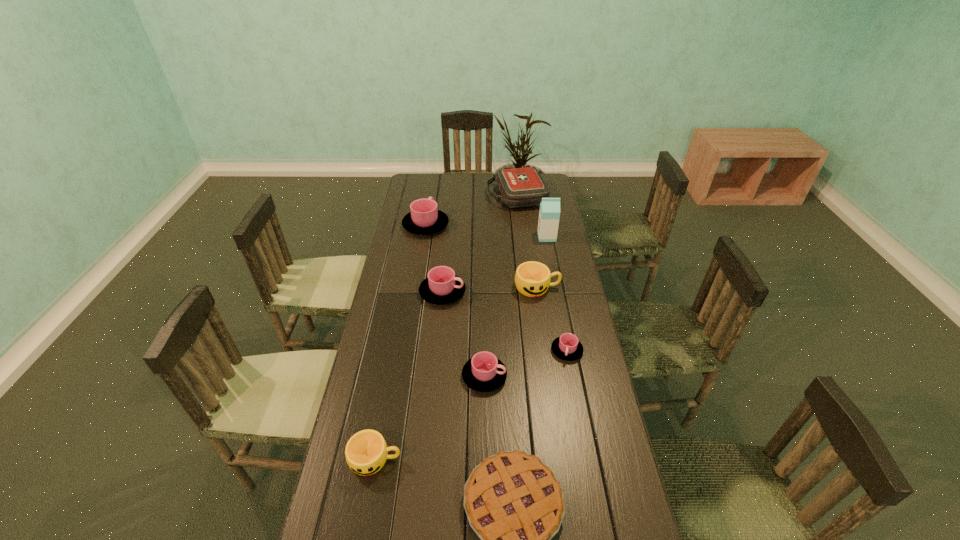
Locate an element on the screen. This screenshot has height=540, width=960. free space located 0.120m on the left of the farther beige cup is located at coordinates (484, 288).

The height and width of the screenshot is (540, 960). In order to click on vacant space located on the side with the handle of the second smallest pink cup in this screenshot , I will do `click(535, 376)`.

Where is `vacant space located on the right of the left beige cup`? vacant space located on the right of the left beige cup is located at coordinates (470, 460).

Find the location of `vacant point located 0.260m on the side with the handle of the shortest cup`. vacant point located 0.260m on the side with the handle of the shortest cup is located at coordinates (583, 436).

At what (x,y) coordinates should I click in order to perform the action: click on object that is at the far edge. Please return your answer as a coordinate pair (x, y). The height and width of the screenshot is (540, 960). Looking at the image, I should click on (523, 187).

At what (x,y) coordinates should I click in order to perform the action: click on milk carton positioned at the right edge. Please return your answer as a coordinate pair (x, y). This screenshot has width=960, height=540. Looking at the image, I should click on (549, 214).

This screenshot has height=540, width=960. Identify the location of the first-aid kit that is at the right edge. (523, 187).

Find the location of `object positioned at the far right corner`. object positioned at the far right corner is located at coordinates (523, 187).

This screenshot has width=960, height=540. I want to click on vacant space at the far edge of the desktop, so click(x=470, y=183).

This screenshot has height=540, width=960. Identify the location of free space at the left edge of the desktop. (403, 252).